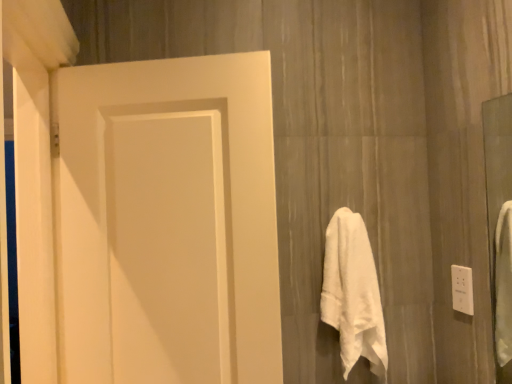
Locate an element on the screen. white plastic outlet at right is located at coordinates (462, 289).

What do you see at coordinates (353, 293) in the screenshot?
I see `white soft towel at center-right` at bounding box center [353, 293].

Locate an element on the screen. The image size is (512, 384). white plastic outlet at right is located at coordinates (462, 289).

From a real-world perspective, is matte white door at left on white soft towel at center-right?

Yes, from a real-world perspective, matte white door at left is over white soft towel at center-right

Considering the relative positions of matte white door at left and white soft towel at center-right in the image provided, is matte white door at left to the right of white soft towel at center-right from the viewer's perspective?

In fact, matte white door at left is to the left of white soft towel at center-right.

Based on their sizes in the image, would you say matte white door at left is bigger or smaller than white soft towel at center-right?

In the image, matte white door at left appears to be larger than white soft towel at center-right.

Does white plastic outlet at right have a greater height compared to white soft towel at center-right?

In fact, white plastic outlet at right may be shorter than white soft towel at center-right.

Looking at the image, does white plastic outlet at right seem bigger or smaller compared to white soft towel at center-right?

Clearly, white plastic outlet at right is smaller in size than white soft towel at center-right.

From a real-world perspective, is white plastic outlet at right beneath white soft towel at center-right?

No.

From the image's perspective, does white plastic outlet at right appear higher than matte white door at left?

No, from the image's perspective, white plastic outlet at right is not on top of matte white door at left.

Between white plastic outlet at right and matte white door at left, which one has larger size?

matte white door at left is bigger.

Does white plastic outlet at right have a greater height compared to matte white door at left?

In fact, white plastic outlet at right may be shorter than matte white door at left.

Is white plastic outlet at right looking in the opposite direction of matte white door at left?

That's not correct — white plastic outlet at right is not looking away from matte white door at left.

Is matte white door at left taller or shorter than white plastic outlet at right?

Considering their sizes, matte white door at left has more height than white plastic outlet at right.

From the image's perspective, is matte white door at left on top of white plastic outlet at right?

Correct, matte white door at left appears higher than white plastic outlet at right in the image.

Is there a large distance between matte white door at left and white plastic outlet at right?

Actually, matte white door at left and white plastic outlet at right are a little close together.

Is matte white door at left looking in the opposite direction of white plastic outlet at right?

No, matte white door at left's orientation is not away from white plastic outlet at right.

Considering the relative positions of white soft towel at center-right and matte white door at left in the image provided, is white soft towel at center-right to the left of matte white door at left from the viewer's perspective?

No, white soft towel at center-right is not to the left of matte white door at left.

Does white soft towel at center-right turn towards matte white door at left?

No, white soft towel at center-right is not facing towards matte white door at left.

Is white soft towel at center-right taller or shorter than matte white door at left?

white soft towel at center-right is shorter than matte white door at left.

Find the location of `towel lying on the right of matte white door at left`. towel lying on the right of matte white door at left is located at coordinates (353, 293).

You are a GUI agent. You are given a task and a screenshot of the screen. Output one action in this format:
    pyautogui.click(x=<x>, y=<y>)
    Task: Click on the electric outlet lying on the right of white soft towel at center-right
    The image size is (512, 384).
    Given the screenshot: What is the action you would take?
    pyautogui.click(x=462, y=289)

Does white soft towel at center-right touch white plastic outlet at right?

white soft towel at center-right and white plastic outlet at right are clearly separated.

Is white plastic outlet at right located within white soft towel at center-right?

No, white plastic outlet at right is not inside white soft towel at center-right.

The width and height of the screenshot is (512, 384). What are the coordinates of `door above the white soft towel at center-right (from the image's perspective)` in the screenshot? It's located at (167, 222).

Where is `electric outlet to the right of white soft towel at center-right`? The height and width of the screenshot is (384, 512). electric outlet to the right of white soft towel at center-right is located at coordinates (462, 289).

When comparing their distances from white plastic outlet at right, does matte white door at left or white soft towel at center-right seem closer?

The object closer to white plastic outlet at right is white soft towel at center-right.

Looking at the image, which one is located further to white plastic outlet at right, white soft towel at center-right or matte white door at left?

matte white door at left.

Estimate the real-world distances between objects in this image. Which object is further from matte white door at left, white soft towel at center-right or white plastic outlet at right?

white plastic outlet at right is positioned further to the anchor matte white door at left.

Looking at the image, which one is located closer to white soft towel at center-right, matte white door at left or white plastic outlet at right?

white plastic outlet at right is closer to white soft towel at center-right.

Based on their spatial positions, is white plastic outlet at right or white soft towel at center-right further from matte white door at left?

The object further to matte white door at left is white plastic outlet at right.

Looking at the image, which one is located further to white soft towel at center-right, white plastic outlet at right or matte white door at left?

matte white door at left lies further to white soft towel at center-right than the other object.

The image size is (512, 384). I want to click on towel between matte white door at left and white plastic outlet at right in the horizontal direction, so click(x=353, y=293).